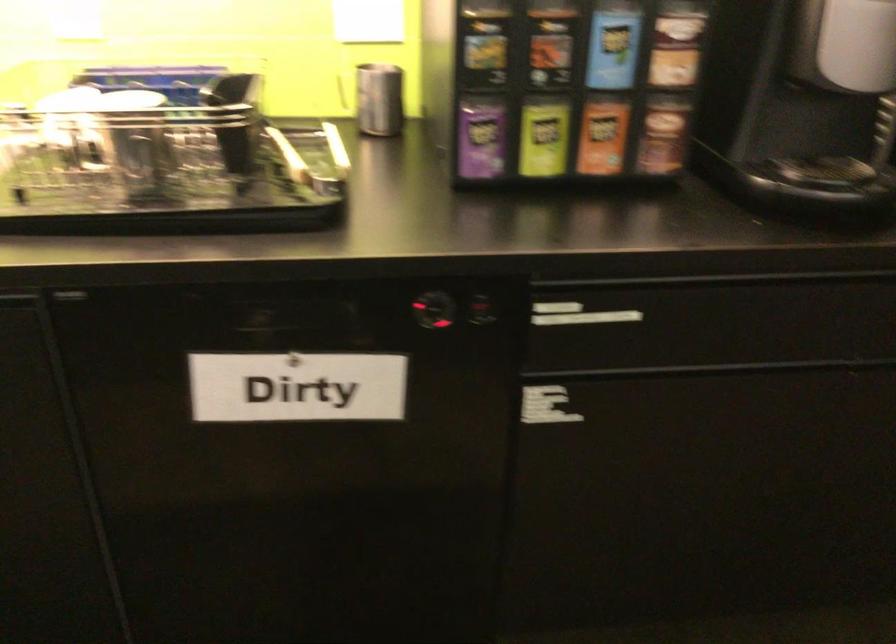
Where would you pull the orange tea box? Please return your answer as a coordinate pair (x, y).

(602, 136)